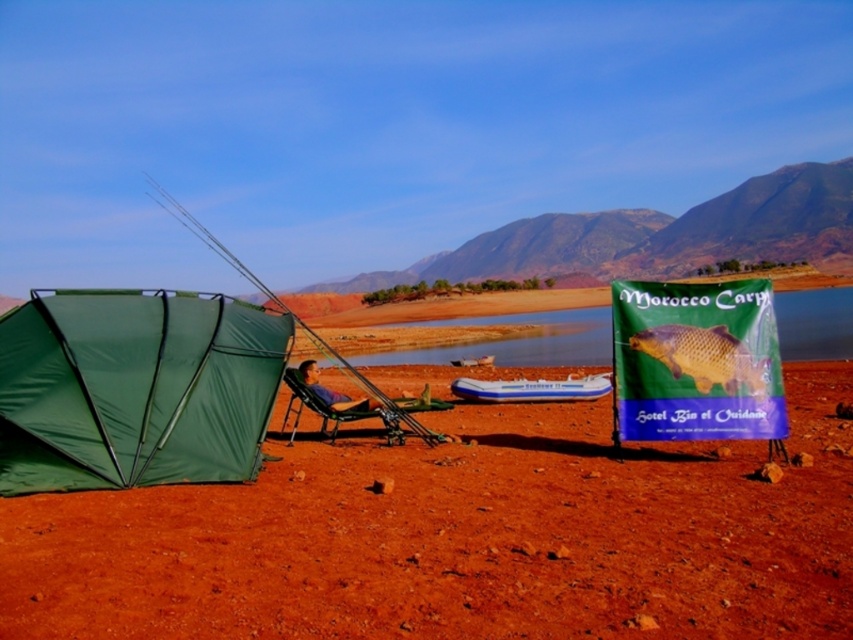
Between golden textured fish at center and blue inflatable boat at center, which one is positioned lower?

Answer: blue inflatable boat at center

Is golden textured fish at center further to camera compared to blue inflatable boat at center?

That is False.

Measure the distance between point (718, 381) and camera.

A distance of 20.44 feet exists between point (718, 381) and camera.

At what (x,y) coordinates should I click in order to perform the action: click on golden textured fish at center. Please return your answer as a coordinate pair (x, y). Looking at the image, I should click on (705, 356).

Between dirt field at lower center and green fabric fishing pole at left, which one has less height?

dirt field at lower center

Where is `dirt field at lower center`? The height and width of the screenshot is (640, 853). dirt field at lower center is located at coordinates (460, 538).

Between green fabric tent at left and green fabric fishing pole at left, which one appears on the right side from the viewer's perspective?

Positioned to the right is green fabric tent at left.

Is point (38, 324) in front of point (221, 246)?

Yes, it is.

Where is `green fabric tent at left`? The height and width of the screenshot is (640, 853). green fabric tent at left is located at coordinates (134, 388).